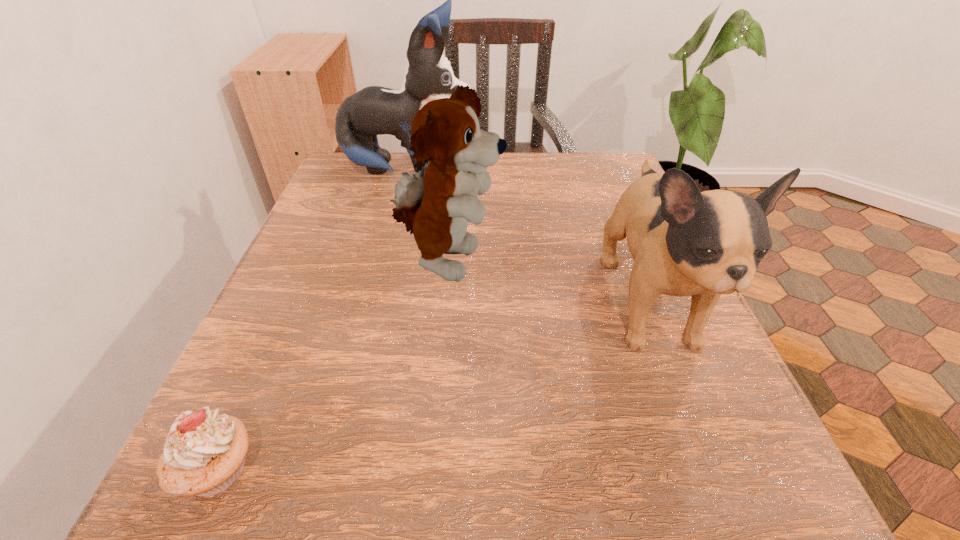
The width and height of the screenshot is (960, 540). What are the coordinates of `vacant space that is in between the shortest object and the farthest puppy` in the screenshot? It's located at (313, 320).

Identify the location of free area in between the farthest object and the rightmost object. The width and height of the screenshot is (960, 540). (529, 238).

Where is `vacant point located between the nearest object and the farthest object`? The image size is (960, 540). vacant point located between the nearest object and the farthest object is located at coordinates (313, 320).

Where is `unoccupied position between the cupcake and the rightmost puppy`? The image size is (960, 540). unoccupied position between the cupcake and the rightmost puppy is located at coordinates (433, 387).

The width and height of the screenshot is (960, 540). Identify the location of object that is the second closest to the rightmost object. (374, 110).

Identify which object is the closest to the farthest object. Please provide its 2D coordinates. Your answer should be formatted as a tuple, i.e. [(x, y)], where the tuple contains the x and y coordinates of a point satisfying the conditions above.

[(436, 205)]

I want to click on puppy identified as the second closest to the nearest object, so click(x=684, y=242).

Where is `puppy that is the closest one to the rightmost object`? puppy that is the closest one to the rightmost object is located at coordinates [436, 205].

The width and height of the screenshot is (960, 540). In order to click on vacant space that satisfies the following two spatial constraints: 1. on the front-facing side of the farthest object; 2. on the front side of the nearest object in this screenshot , I will do `click(336, 469)`.